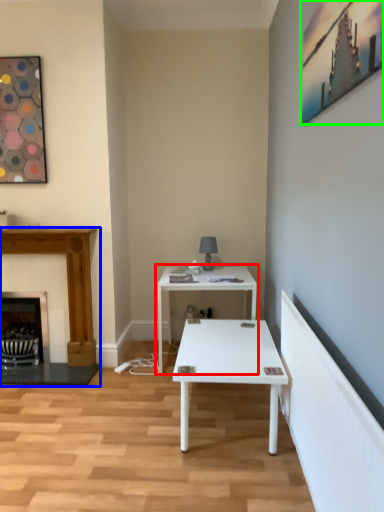
Question: Which object is positioned farthest from table (highlighted by a red box)? Select from fireplace (highlighted by a blue box) and picture frame (highlighted by a green box).

Choices:
 (A) fireplace
 (B) picture frame

Answer: (B)